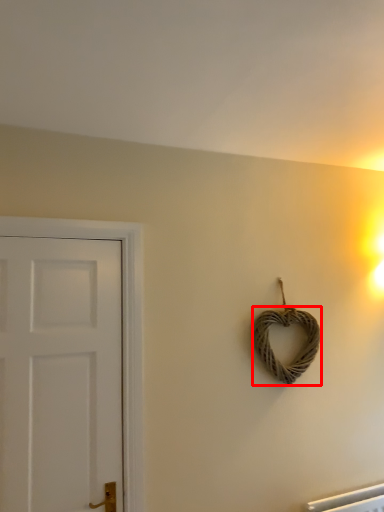
Question: In this image, where is rope (annotated by the red box) located relative to door?

Choices:
 (A) right
 (B) left

Answer: (A)